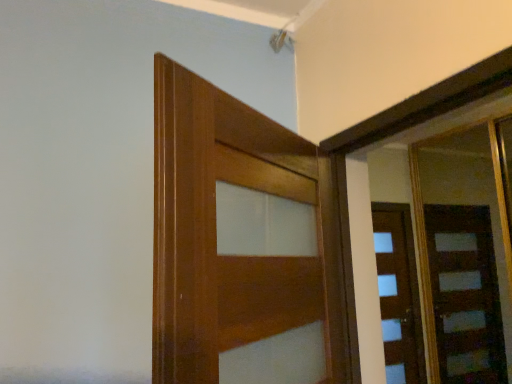
Question: From their relative heights in the image, would you say wooden door at center, marked as the first door in a left-to-right arrangement, is taller or shorter than wooden door at right, acting as the 1th door starting from the right?

Choices:
 (A) tall
 (B) short

Answer: (B)

Question: From the image's perspective, is wooden door at center, the 1th door positioned from the front, located above or below wooden door at right, acting as the 1th door starting from the right?

Choices:
 (A) above
 (B) below

Answer: (A)

Question: From a real-world perspective, relative to wooden door at right, which is the 1th door in back-to-front order, is wooden door at center, placed as the 2th door when sorted from right to left, vertically above or below?

Choices:
 (A) below
 (B) above

Answer: (A)

Question: Considering the positions of wooden door at right, which ranks as the second door in front-to-back order, and wooden door at center, marked as the first door in a left-to-right arrangement, in the image, is wooden door at right, which ranks as the second door in front-to-back order, wider or thinner than wooden door at center, marked as the first door in a left-to-right arrangement,?

Choices:
 (A) thin
 (B) wide

Answer: (A)

Question: From a real-world perspective, is wooden door at right, acting as the 1th door starting from the right, physically located above or below wooden door at center, the second door positioned from the back?

Choices:
 (A) above
 (B) below

Answer: (A)

Question: Relative to wooden door at center, the second door positioned from the back, is wooden door at right, the 2th door when ordered from left to right, in front or behind?

Choices:
 (A) behind
 (B) front

Answer: (A)

Question: Is wooden door at right, which ranks as the second door in front-to-back order, inside the boundaries of wooden door at center, placed as the 2th door when sorted from right to left, or outside?

Choices:
 (A) outside
 (B) inside

Answer: (A)